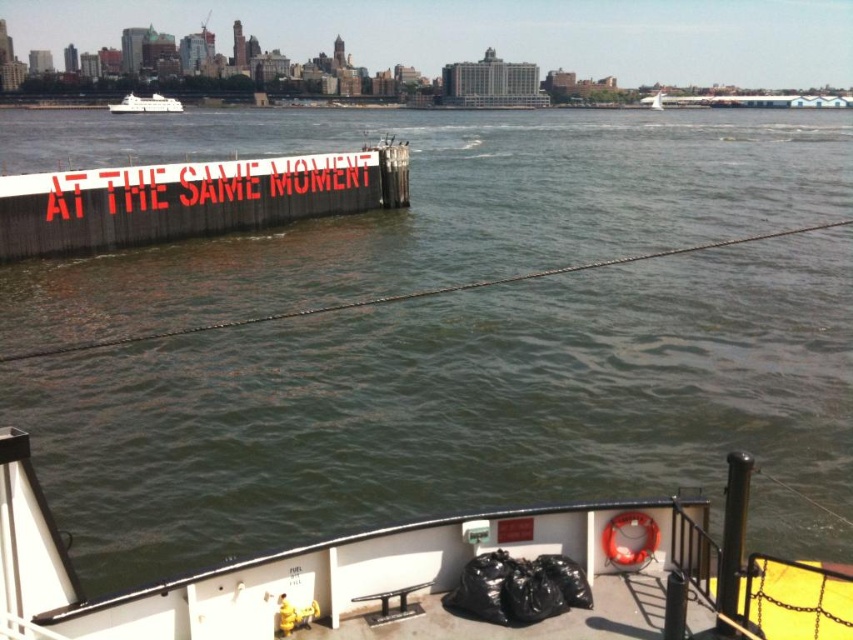
You are a painter who needs to choose between painting the white painted wood sign at upper left and the white glossy boat at upper left. If you want to paint the smaller object first, which one should you start with?

The white painted wood sign at upper left is smaller in width than the white glossy boat at upper left, so you should start with the white painted wood sign at upper left.

You are standing on the wooden pier on the left side of the image. You want to board the white matte boat at lower center. If your walking speed is 1.5 meters per second, how many seconds will it take you to reach the boat?

The distance between you and the white matte boat at lower center is 9.17 meters. At a walking speed of 1.5 meters per second, dividing the distance by the speed gives approximately 6.11 seconds. Therefore, it will take about 6.11 seconds to reach the boat.